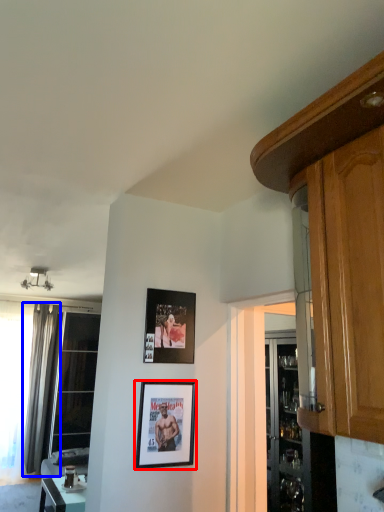
Question: Which of the following is the farthest to the observer, picture frame (highlighted by a red box) or curtain (highlighted by a blue box)?

Choices:
 (A) picture frame
 (B) curtain

Answer: (B)